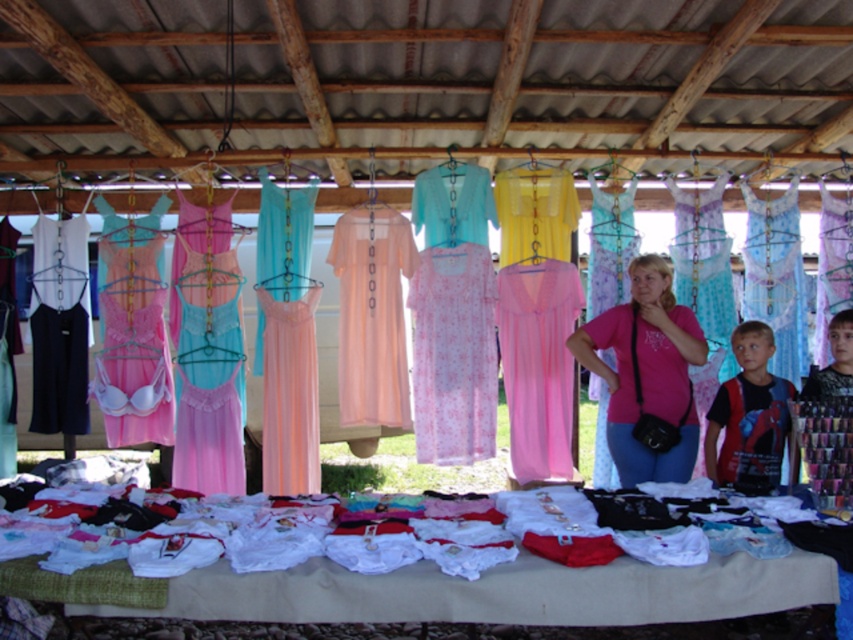
You are a customer at the market stall and want to buy both the pink floral fabric dress at center and the pink satin nightgown at center. If you first pick up the item on the left, which one will you choose?

The pink satin nightgown at center is on the left side, so you will first pick up the pink satin nightgown at center.